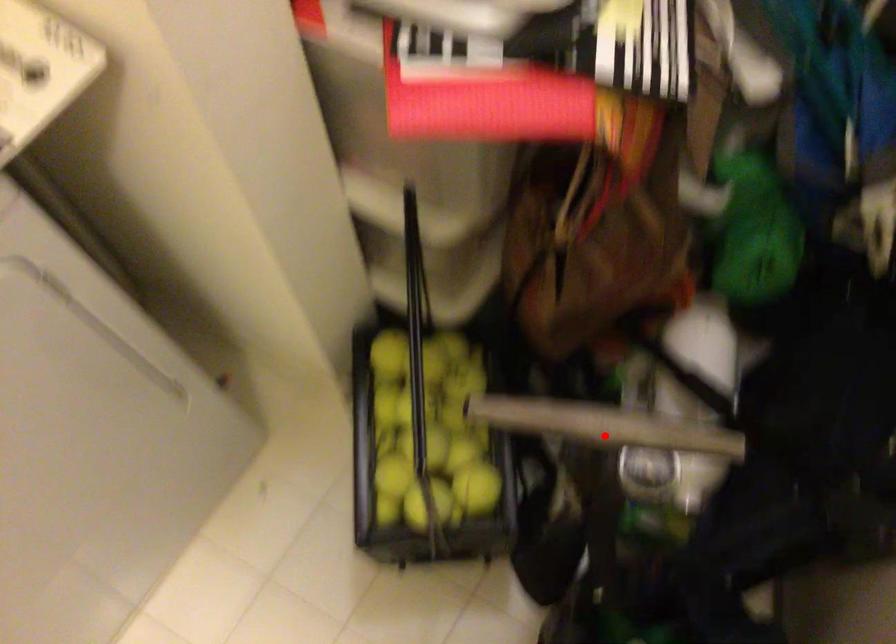
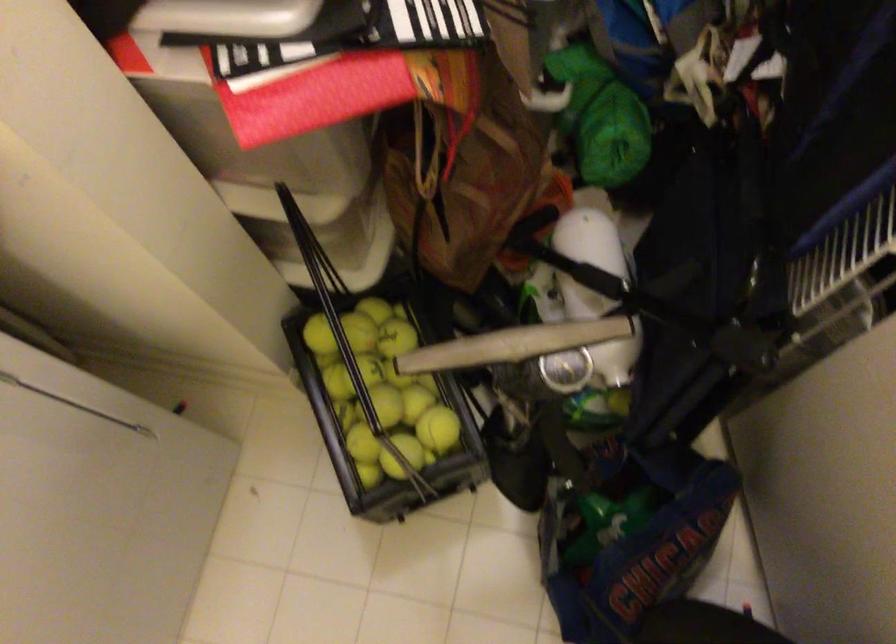
Question: I am providing you with two images of the same scene from different viewpoints. In image1, a red point is highlighted. Considering the same 3D point in image2, which of the following is correct?

Choices:
 (A) It is closer
 (B) It is farther

Answer: (B)